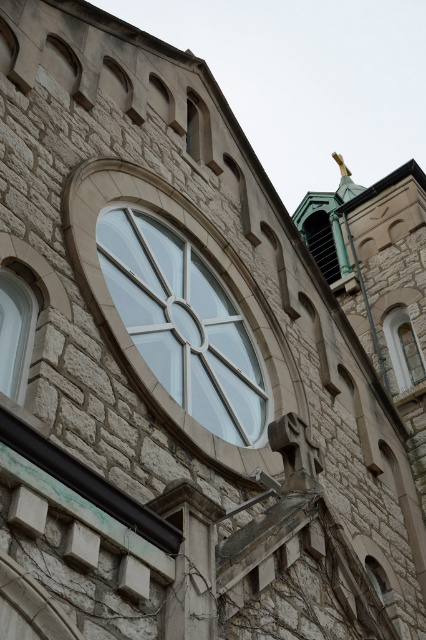
Between clear glass window at left and green glass window at upper center, which one has less height?

clear glass window at left

Does clear glass window at left have a greater height compared to green glass window at upper center?

In fact, clear glass window at left may be shorter than green glass window at upper center.

Is point (17, 332) farther from camera compared to point (322, 269)?

No, (17, 332) is in front of (322, 269).

Image resolution: width=426 pixels, height=640 pixels. I want to click on clear glass window at left, so click(16, 332).

Is clear glass window at upper right bigger than clear glass window at upper center?

Yes.

What do you see at coordinates (403, 348) in the screenshot? Image resolution: width=426 pixels, height=640 pixels. I see `clear glass window at upper right` at bounding box center [403, 348].

Identify the location of clear glass window at upper right. (403, 348).

Is clear glass window at upper right to the right of green glass window at upper center from the viewer's perspective?

→ Correct, you'll find clear glass window at upper right to the right of green glass window at upper center.

Which of these two, clear glass window at upper right or green glass window at upper center, stands shorter?

Standing shorter between the two is clear glass window at upper right.

Between point (397, 360) and point (319, 234), which one is positioned in front?

Point (397, 360) is more forward.

Image resolution: width=426 pixels, height=640 pixels. I want to click on clear glass window at upper right, so click(x=403, y=348).